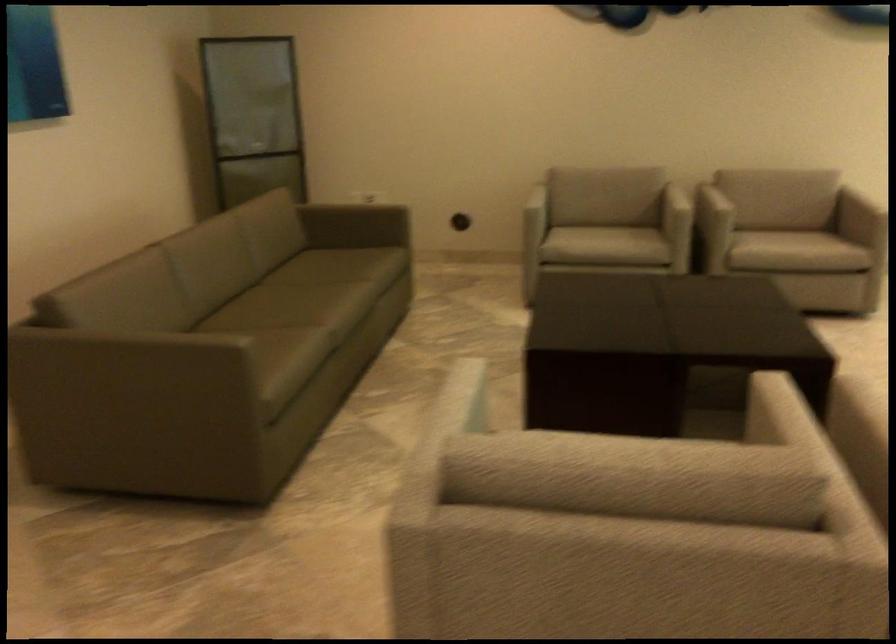
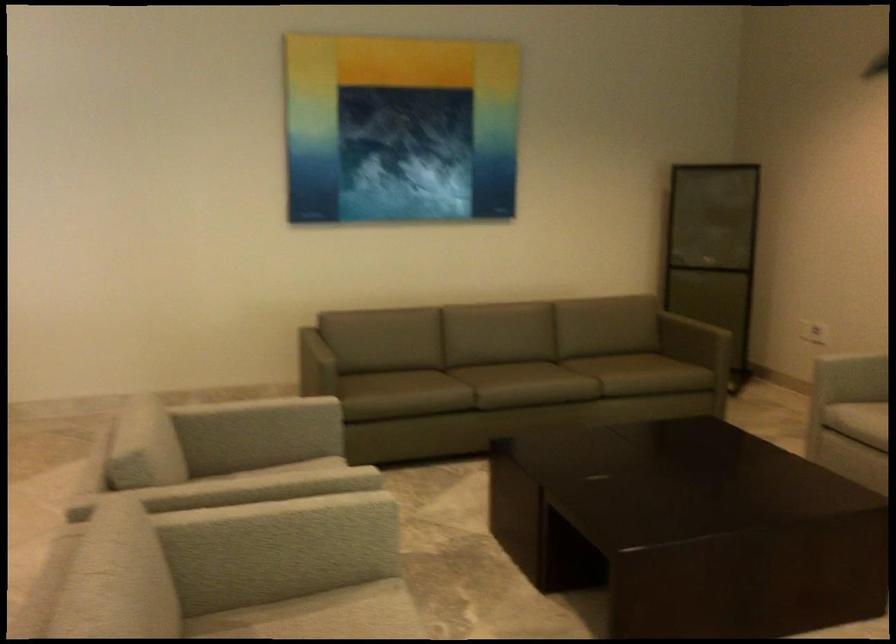
Find the pixel in the second image that matches the point at 573,238 in the first image.

(857, 420)